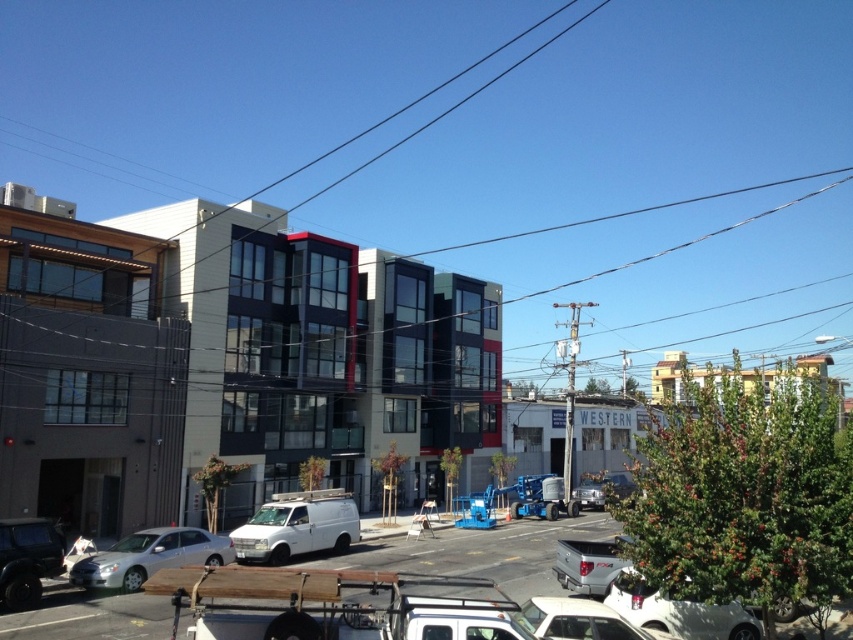
You are a delivery driver trying to park your vehicle between the white matte van at lower center and the silver metallic truck at lower center. Based on the scene, can you safely maneuver your vehicle into that space?

The white matte van at lower center is further to the viewer than the silver metallic truck at lower center, so the space between them might be too narrow for your vehicle to maneuver safely. It is recommended to look for a wider space.

Consider the image. You are a delivery driver trying to park your 2.5 meter wide truck in the urban street scene. You see the white matte van at lower center and the silver metallic truck at lower center. Which vehicle should you avoid parking next to to ensure enough space?

Answer: The white matte van at lower center might be wider than the silver metallic truck at lower center, so you should avoid parking next to the white matte van at lower center to ensure enough space.